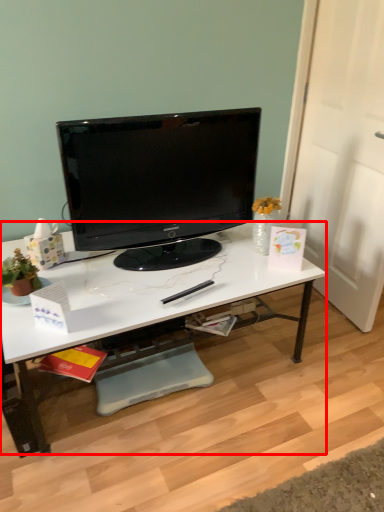
Question: From the image's perspective, what is the correct spatial relationship of desk (annotated by the red box) in relation to television?

Choices:
 (A) above
 (B) below

Answer: (B)